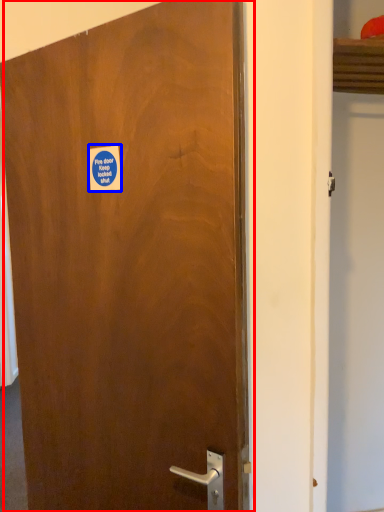
Question: Which object is closer to the camera taking this photo, door (highlighted by a red box) or sticker (highlighted by a blue box)?

Choices:
 (A) door
 (B) sticker

Answer: (A)